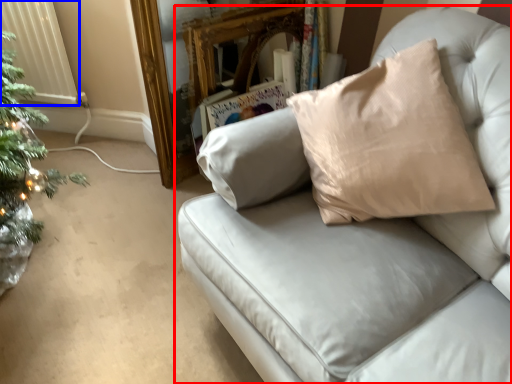
Question: Among these objects, which one is nearest to the camera, studio couch (highlighted by a red box) or radiator (highlighted by a blue box)?

Choices:
 (A) studio couch
 (B) radiator

Answer: (A)